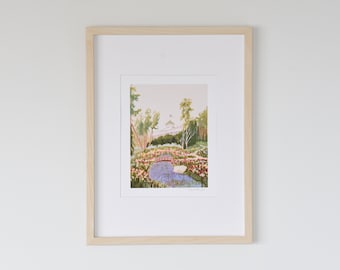
The height and width of the screenshot is (270, 340). I want to click on top right corner of frame, so click(x=250, y=29).